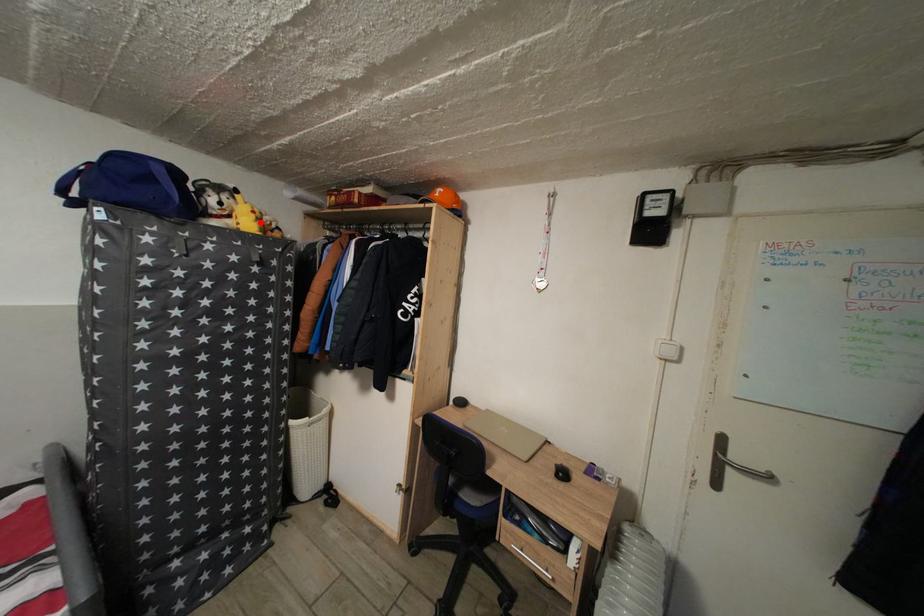
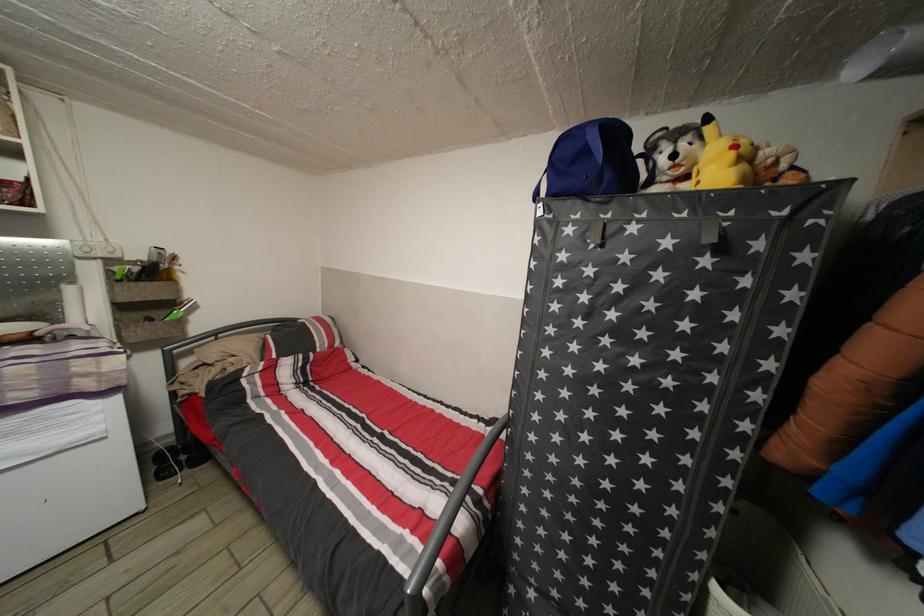
Where in the second image is the point corresponding to the highlighted location from the first image?

(738, 161)